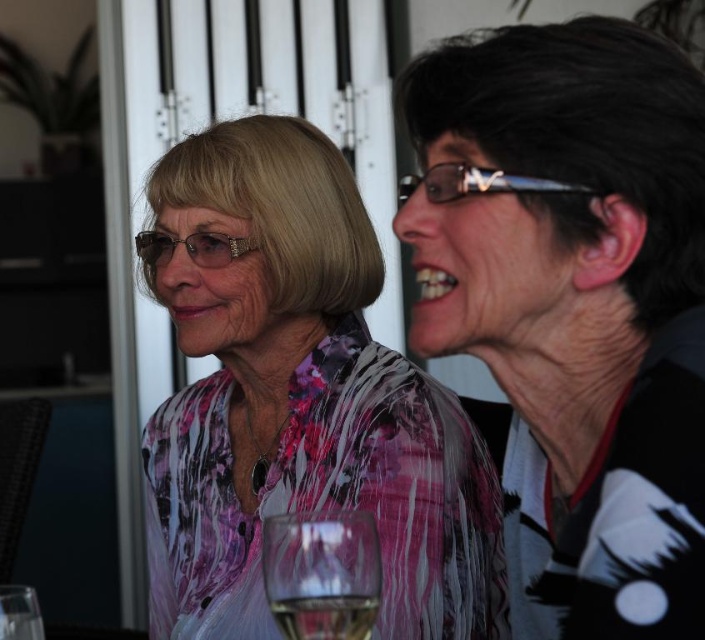
You are a delivery robot with a package that is 10 inches wide. You need to navigate between the black glossy hair at upper right and the clear glass at lower center to reach the delivery point. Can you fit through the space between them?

The distance between the black glossy hair at upper right and the clear glass at lower center is 9.84 inches. Since your package is 10 inches wide, it is slightly wider than the available space. Therefore, you cannot fit through the space between them.

In the scene shown: You are a bartender preparing drinks and need to choose the appropriate glass for a cocktail that requires a standard thickness. You see two clear plastic glasses at upper center and clear plastic glasses at center. Which one should you choose?

The clear plastic glasses at center should be chosen because the clear plastic glasses at upper center is thinner than clear plastic glasses at center, so the thicker glass at center is suitable for standard thickness requirements.

You are a bartender preparing drinks for two people. You have two clear plastic glasses in front of you. One is labeled as clear plastic glasses at upper center and the other as clear plastic glasses at center. The customer prefers their drink to be served closer to them. Which glass should you choose?

The clear plastic glasses at upper center is in front of clear plastic glasses at center, so the customer should choose the clear plastic glasses at upper center as it is closer to them.